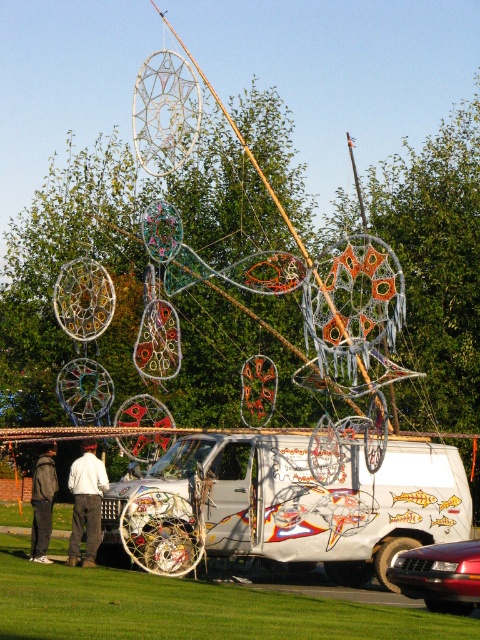
You are standing in front of the van and want to reach both the point at coordinates point (x=144, y=515) and point (x=437, y=589). Which point will you reach first?

You will reach point (x=144, y=515) first because it is closer to you than point (x=437, y=589), which is further away.